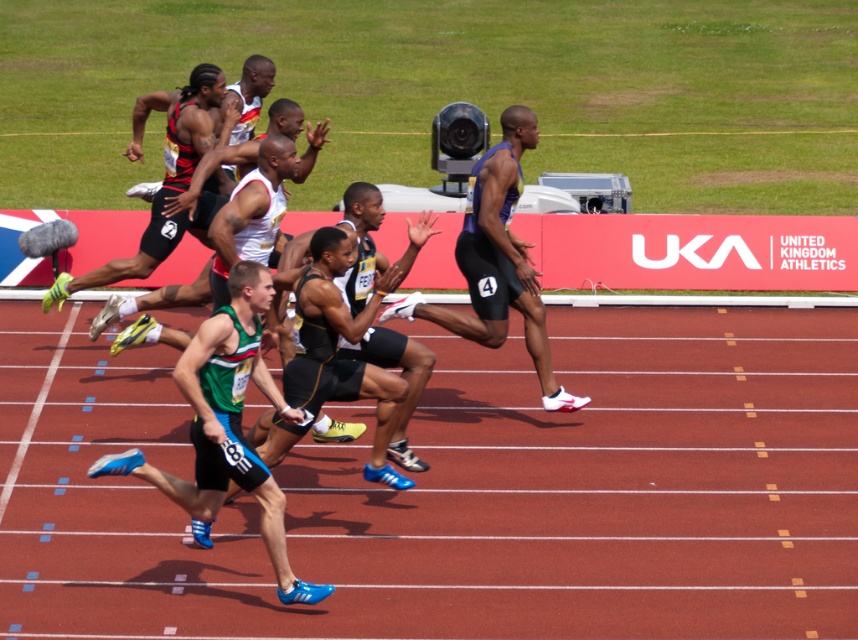
Which is behind, point (71, 344) or point (289, 600)?

Point (71, 344)

Does rubber track at center appear over green matte shorts at center?

Actually, rubber track at center is below green matte shorts at center.

What do you see at coordinates (478, 496) in the screenshot?
I see `rubber track at center` at bounding box center [478, 496].

Where is `rubber track at center`? The width and height of the screenshot is (858, 640). rubber track at center is located at coordinates (478, 496).

Which is above, green matte shorts at center or matte black shorts at center?

matte black shorts at center

Is green matte shorts at center behind matte black shorts at center?

No, it is not.

Between point (198, 365) and point (240, 250), which one is positioned in front?

Point (198, 365) is more forward.

In order to click on green matte shorts at center in this screenshot , I will do `click(227, 426)`.

Does rubber track at center appear over matte black shorts at center?

No.

Between rubber track at center and matte black shorts at center, which one appears on the left side from the viewer's perspective?

matte black shorts at center is more to the left.

I want to click on rubber track at center, so click(478, 496).